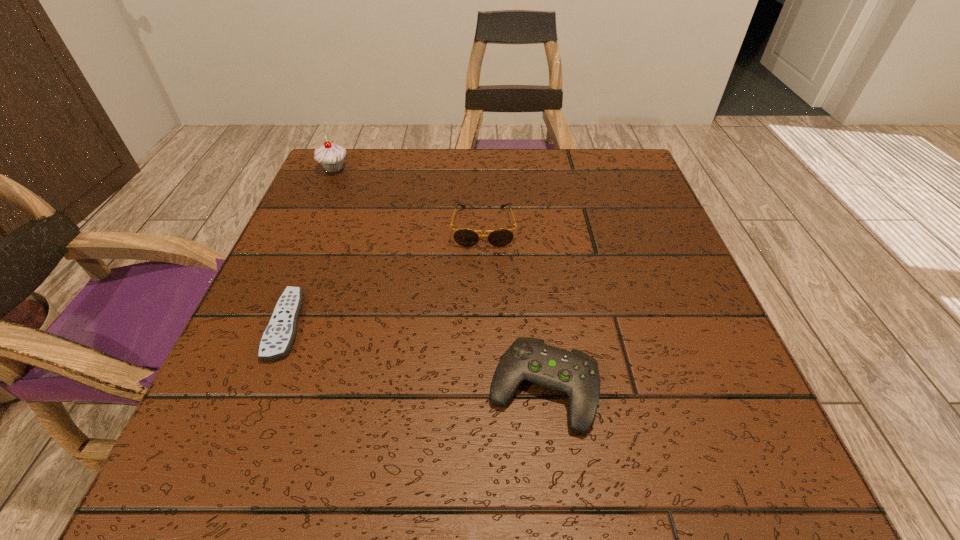
The image size is (960, 540). What are the coordinates of `the tallest object` in the screenshot? It's located at (331, 156).

What are the coordinates of `the farthest object` in the screenshot? It's located at (331, 156).

The height and width of the screenshot is (540, 960). Identify the location of the third nearest object. (464, 237).

Where is `control`? control is located at coordinates (574, 373).

Identify the location of the shortest object. (x=277, y=339).

Locate an element on the screen. The width and height of the screenshot is (960, 540). free space located on the front of the tallest object is located at coordinates click(305, 234).

Where is `free space located on the lenses of the third nearest object`? free space located on the lenses of the third nearest object is located at coordinates (484, 289).

Identify the location of vacant region located on the left of the control. This screenshot has height=540, width=960. (393, 389).

Find the location of a particular element. Image resolution: width=960 pixels, height=540 pixels. vacant space located 0.400m on the right of the shortest object is located at coordinates (544, 325).

I want to click on object present at the far edge, so click(x=331, y=156).